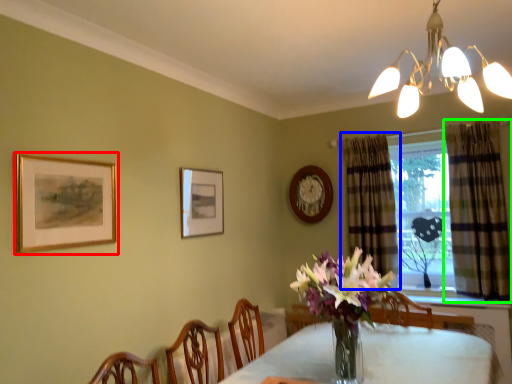
Question: Based on their relative distances, which object is farther from picture frame (highlighted by a red box)? Choose from curtain (highlighted by a blue box) and curtain (highlighted by a green box).

Choices:
 (A) curtain
 (B) curtain

Answer: (B)